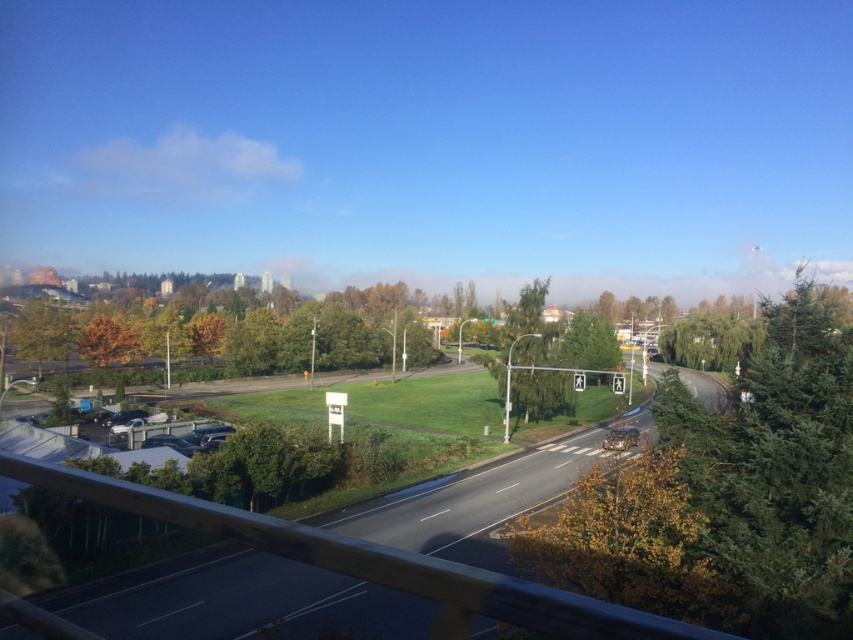
Does asphalt road at center appear under green leafy tree at center?

Yes.

Does asphalt road at center appear on the right side of green leafy tree at center?

Incorrect, asphalt road at center is not on the right side of green leafy tree at center.

Locate an element on the screen. Image resolution: width=853 pixels, height=640 pixels. asphalt road at center is located at coordinates 357,563.

The height and width of the screenshot is (640, 853). Find the location of `asphalt road at center`. asphalt road at center is located at coordinates (357, 563).

Is asphalt road at center below green matte tree at upper left?

Indeed, asphalt road at center is positioned under green matte tree at upper left.

Is point (401, 582) farther from viewer compared to point (22, 333)?

No.

Where is `asphalt road at center`? The image size is (853, 640). asphalt road at center is located at coordinates (357, 563).

Can you confirm if green leafy tree at center is taller than green matte tree at upper left?

Yes.

Between green leafy tree at center and green matte tree at upper left, which one has more height?

Standing taller between the two is green leafy tree at center.

Where is `green leafy tree at center`? green leafy tree at center is located at coordinates (529, 324).